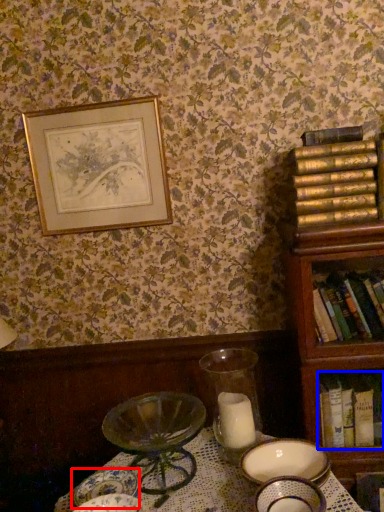
Question: Which of the following is the farthest to the observer, tableware (highlighted by a red box) or book (highlighted by a blue box)?

Choices:
 (A) tableware
 (B) book

Answer: (B)